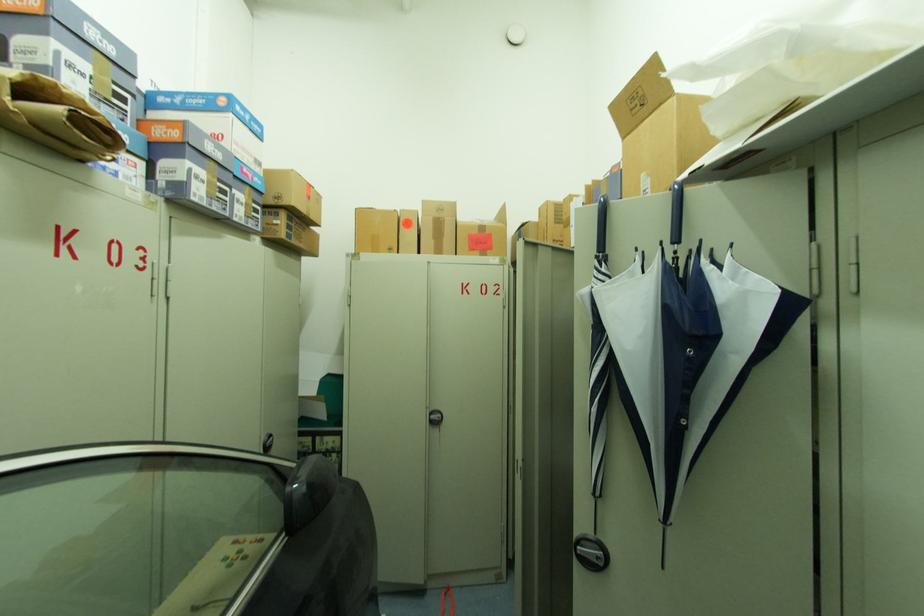
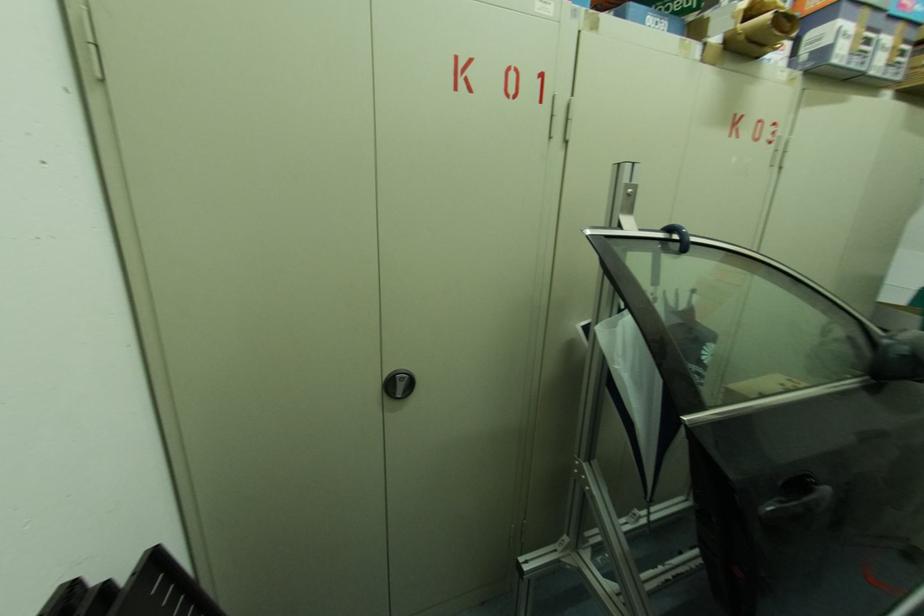
Based on the continuous images, in which direction is the camera rotating?

A: The camera rotated toward left-down.